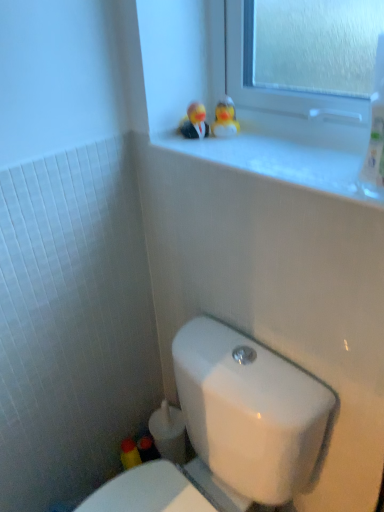
Find the location of `vacant area that is in front of rubber duck at upper center, placed as the 1th miniature when sorted from left to right`. vacant area that is in front of rubber duck at upper center, placed as the 1th miniature when sorted from left to right is located at coordinates (205, 154).